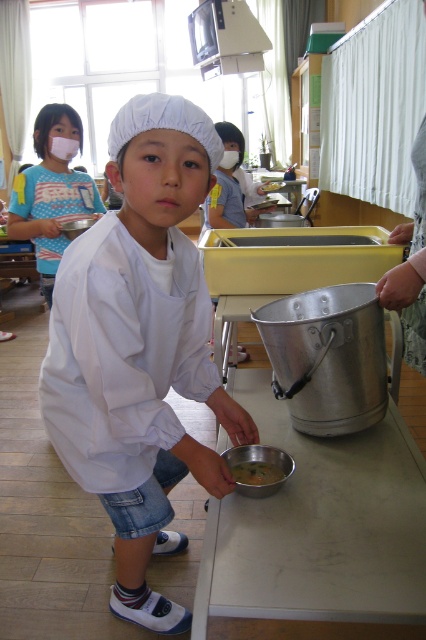
Describe the element at coordinates (51, 189) in the screenshot. The height and width of the screenshot is (640, 426). I see `matte blue shirt at upper left` at that location.

What do you see at coordinates (51, 189) in the screenshot? This screenshot has height=640, width=426. I see `matte blue shirt at upper left` at bounding box center [51, 189].

The height and width of the screenshot is (640, 426). What are the coordinates of `matte blue shirt at upper left` in the screenshot? It's located at (51, 189).

Does point (169, 140) come in front of point (34, 145)?

Yes, point (169, 140) is closer to viewer.

Between point (155, 484) and point (46, 195), which one is positioned in front?

Point (155, 484) is in front.

Is point (184, 332) closer to viewer compared to point (14, 200)?

Yes, point (184, 332) is in front of point (14, 200).

Where is `white matte chef hat at center`? The image size is (426, 640). white matte chef hat at center is located at coordinates pos(140,348).

Can you confirm if metallic silver bucket at right is positioned to the right of metallic silver bowl at lower center?

Correct, you'll find metallic silver bucket at right to the right of metallic silver bowl at lower center.

Is point (394, 278) farther from camera compared to point (81, 228)?

No, (394, 278) is in front of (81, 228).

I want to click on metallic silver bucket at right, so click(x=411, y=268).